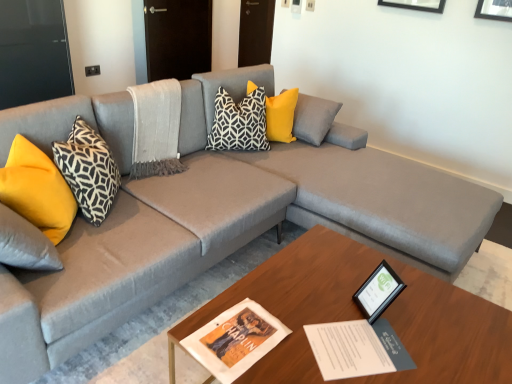
The height and width of the screenshot is (384, 512). Find the location of `unoccupied region to the right of black glossy picture frame at lower right`. unoccupied region to the right of black glossy picture frame at lower right is located at coordinates (420, 312).